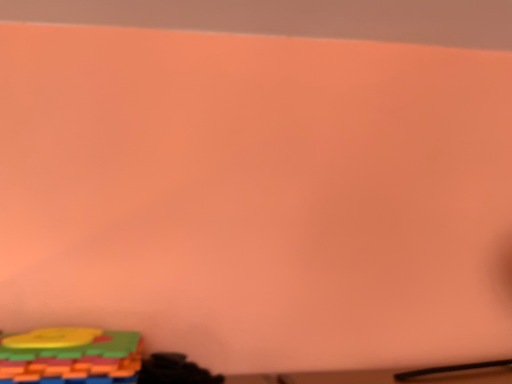
Find the location of a particular element. Image resolution: width=512 pixels, height=384 pixels. blank space situated above multicolored plastic blocks at lower left, which is counted as the second toy, starting from the right (from a real-world perspective) is located at coordinates (58, 336).